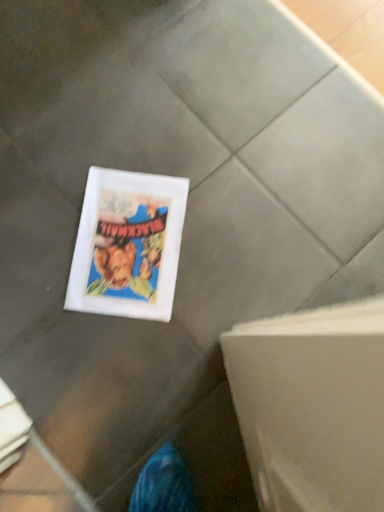
You are a GUI agent. You are given a task and a screenshot of the screen. Output one action in this format:
    pyautogui.click(x=<x>, y=<y>)
    Task: Click on the white matte paper at center
    The height and width of the screenshot is (512, 384).
    Given the screenshot: What is the action you would take?
    pyautogui.click(x=128, y=245)

The width and height of the screenshot is (384, 512). What do you see at coordinates (128, 245) in the screenshot? I see `white matte paper at center` at bounding box center [128, 245].

Locate an element on the screen. white matte paper at center is located at coordinates (128, 245).